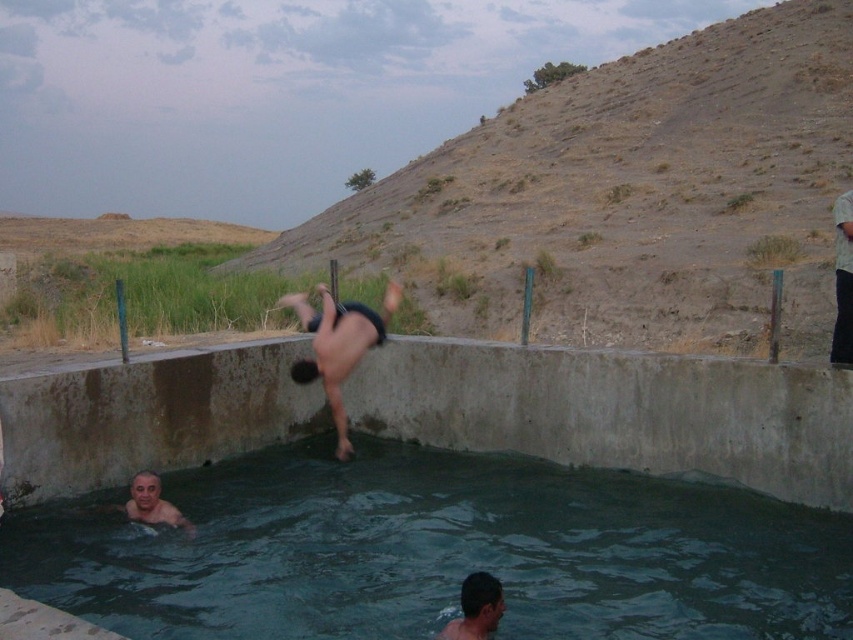
Question: Is black matte shorts at center smaller than light brown fabric shirt at right?

Choices:
 (A) no
 (B) yes

Answer: (B)

Question: In this image, where is dark gray concrete swimming pool at lower center located relative to smooth skin man at lower left?

Choices:
 (A) below
 (B) above

Answer: (A)

Question: Which object is positioned farthest from the smooth skin man at lower left?

Choices:
 (A) light brown fabric shirt at right
 (B) dark gray concrete swimming pool at lower center
 (C) smooth skin head at lower center
 (D) dull brown dirt at upper center

Answer: (D)

Question: Which point appears farthest from the camera in this image?

Choices:
 (A) (125, 515)
 (B) (634, 500)

Answer: (B)

Question: Which of the following is the closest to the observer?

Choices:
 (A) light brown fabric shirt at right
 (B) dark gray concrete swimming pool at lower center
 (C) smooth skin head at lower center
 (D) dull brown dirt at upper center

Answer: (C)

Question: Considering the relative positions of dark gray concrete swimming pool at lower center and smooth skin head at lower center in the image provided, where is dark gray concrete swimming pool at lower center located with respect to smooth skin head at lower center?

Choices:
 (A) right
 (B) left

Answer: (B)